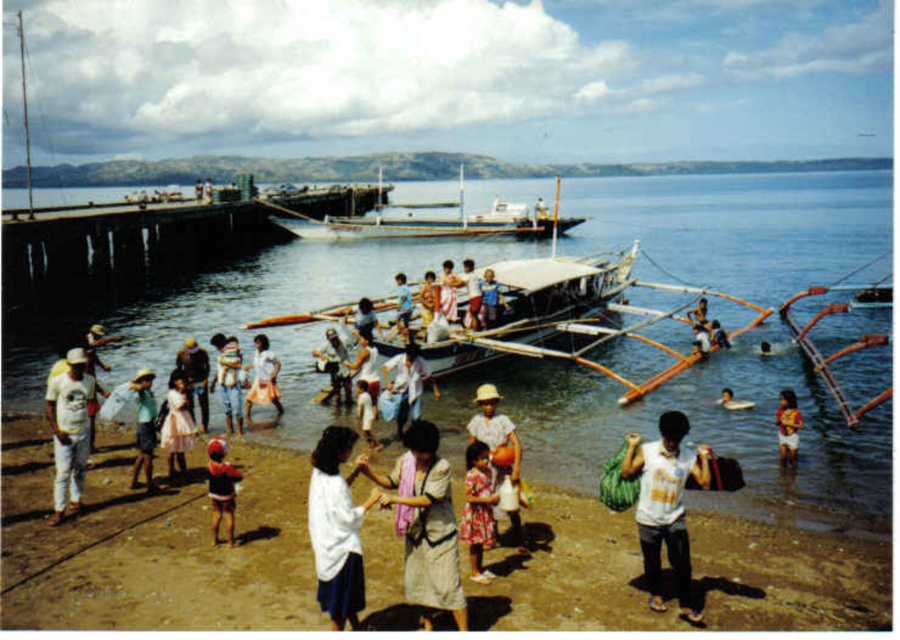
Does clear blue water at center appear on the right side of white cotton shirt at lower left?

No, clear blue water at center is not to the right of white cotton shirt at lower left.

Describe the element at coordinates (703, 429) in the screenshot. The height and width of the screenshot is (640, 900). I see `clear blue water at center` at that location.

Is point (756, 179) farther from camera compared to point (79, 394)?

Yes.

Locate an element on the screen. Image resolution: width=900 pixels, height=640 pixels. clear blue water at center is located at coordinates (703, 429).

Can you confirm if white fabric at center is smaller than white cotton shirt at lower left?

Actually, white fabric at center might be larger than white cotton shirt at lower left.

Is white fabric at center thinner than white cotton shirt at lower left?

No, white fabric at center is not thinner than white cotton shirt at lower left.

Does point (347, 536) come farther from viewer compared to point (60, 452)?

No, (347, 536) is closer to viewer.

Where is `white fabric at center`? This screenshot has height=640, width=900. white fabric at center is located at coordinates click(x=336, y=529).

Which is more to the left, printed cotton dress at center or pink satin dress at center?

Positioned to the left is pink satin dress at center.

Can you confirm if printed cotton dress at center is bigger than pink satin dress at center?

Incorrect, printed cotton dress at center is not larger than pink satin dress at center.

At what (x,y) coordinates should I click in order to perform the action: click on printed cotton dress at center. Please return your answer as a coordinate pair (x, y). The height and width of the screenshot is (640, 900). Looking at the image, I should click on (500, 454).

This screenshot has height=640, width=900. I want to click on printed cotton dress at center, so click(x=500, y=454).